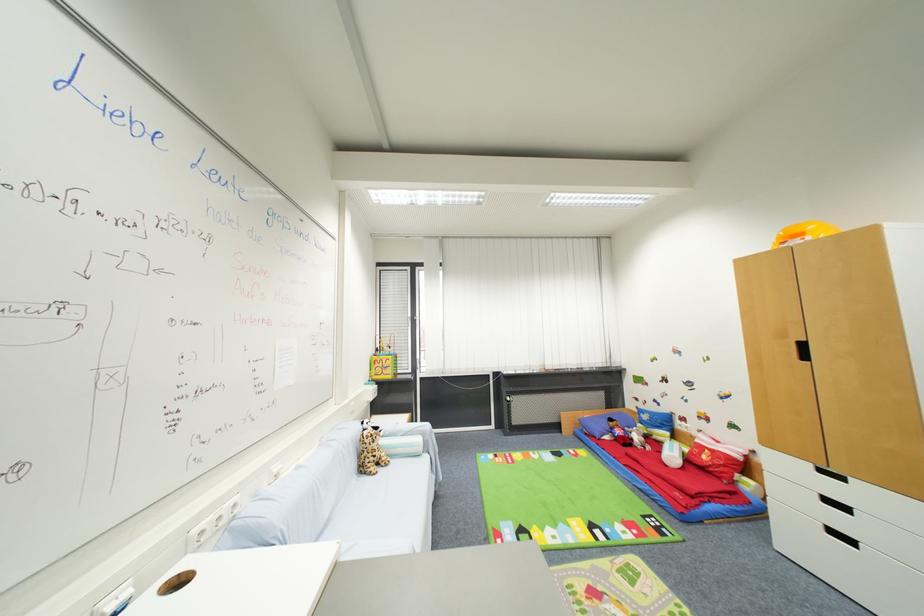
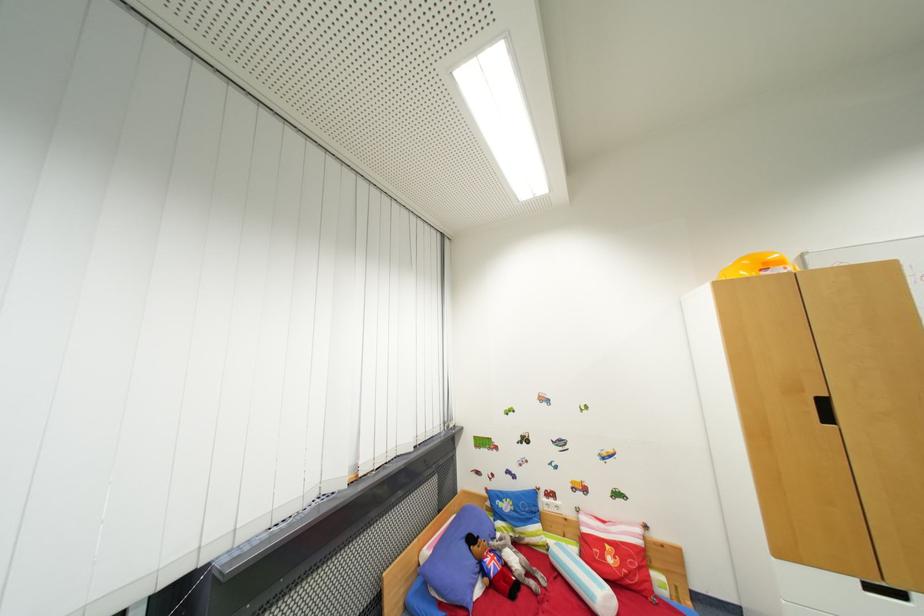
Locate, in the second image, the point that corresponds to [710,459] in the first image.

(614, 562)